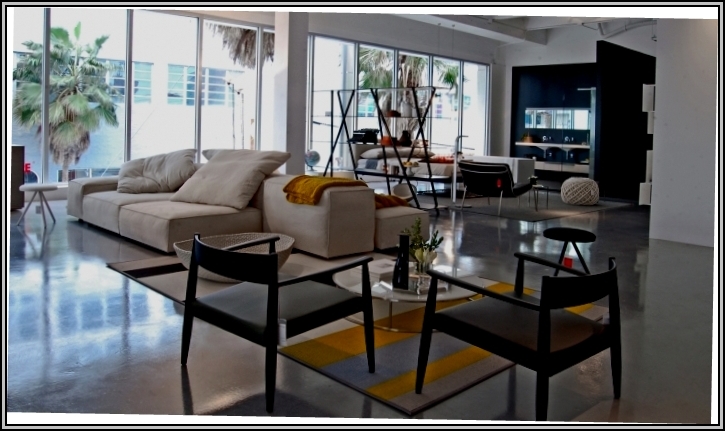
Find the location of `ceiling`. ceiling is located at coordinates click(x=481, y=24).